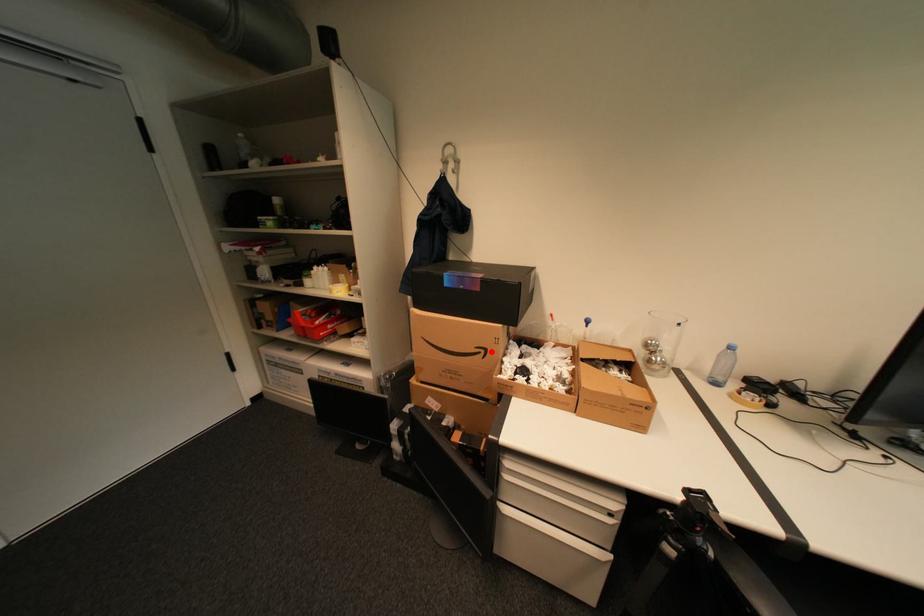
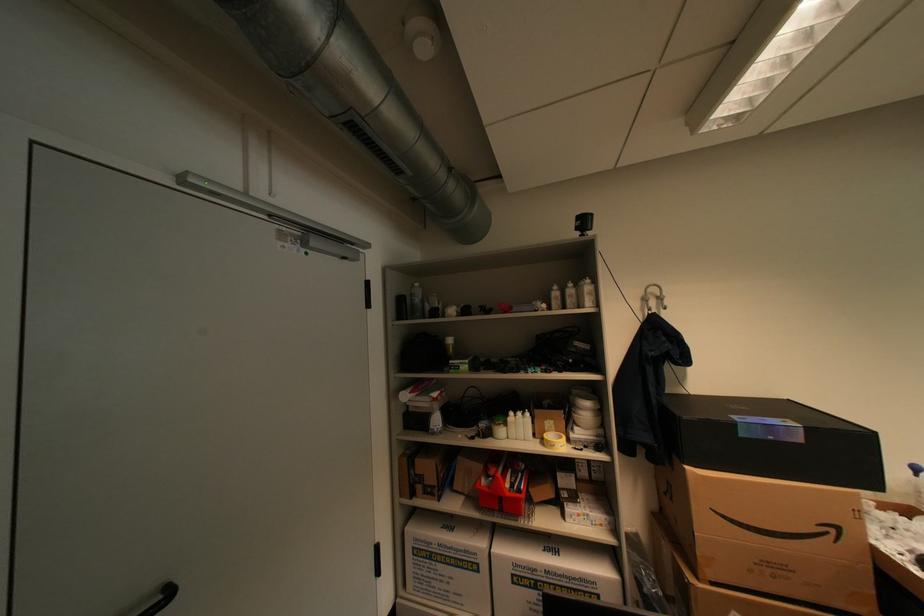
Question: I am providing you with two images of the same scene from different viewpoints. A red point is shown in image1. For the corresponding object point in image2, is it positioned nearer or farther from the camera?

Choices:
 (A) Nearer
 (B) Farther

Answer: (A)